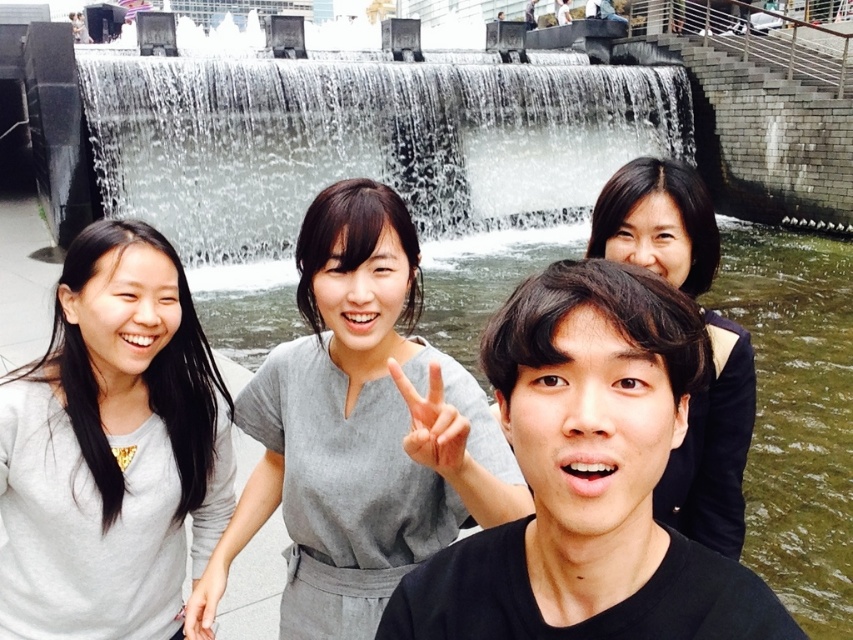
You are trying to decide which object is larger between the gray matte sweater at left and the dark brown hair at upper right. Based on the scene, which one is bigger?

The dark brown hair at upper right is larger than the gray matte sweater at left.

You are a photographer trying to capture a closeup of the gray matte dress at center and the dark brown hair at upper right. Which object should you zoom in on first to ensure it fits in the frame?

The gray matte dress at center is smaller than the dark brown hair at upper right, so you should zoom in on the dark brown hair at upper right first to ensure it fits in the frame before adjusting for the smaller dress.